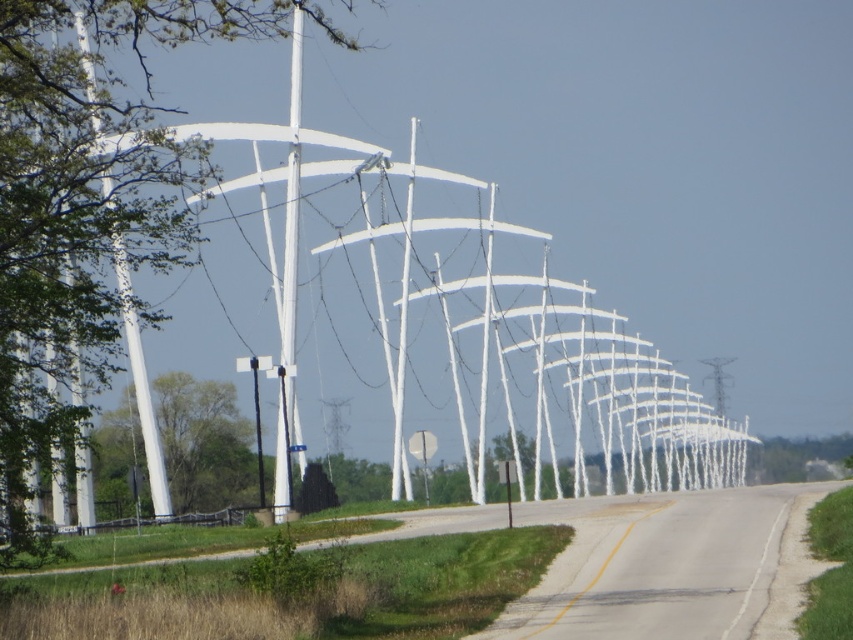
Question: Which is farther from the green leafy tree at left?

Choices:
 (A) yellow painted line at center
 (B) white glossy pole at center
 (C) green leafy tree at center

Answer: (A)

Question: Can you confirm if green leafy tree at left is bigger than green leafy tree at center?

Choices:
 (A) yes
 (B) no

Answer: (A)

Question: Based on their relative distances, which object is farther from the green leafy tree at center?

Choices:
 (A) green leafy tree at left
 (B) white glossy pole at center

Answer: (A)

Question: Is green leafy tree at left below yellow painted line at center?

Choices:
 (A) no
 (B) yes

Answer: (A)

Question: Does white glossy pole at center have a greater width compared to yellow painted line at center?

Choices:
 (A) yes
 (B) no

Answer: (A)

Question: Which object is positioned closest to the green leafy tree at left?

Choices:
 (A) yellow painted line at center
 (B) white glossy pole at center
 (C) green leafy tree at center

Answer: (B)